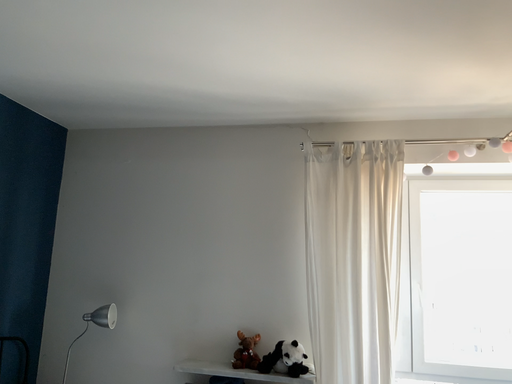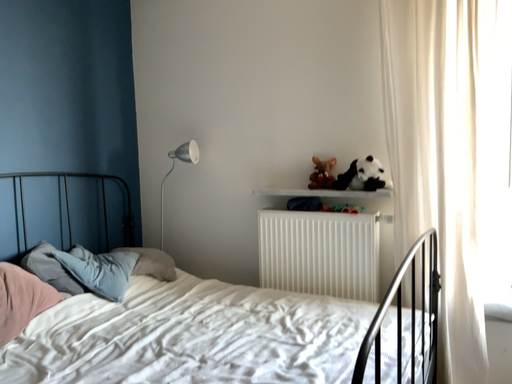
Question: Which way did the camera rotate in the video?

Choices:
 (A) rotated upward
 (B) rotated downward

Answer: (B)